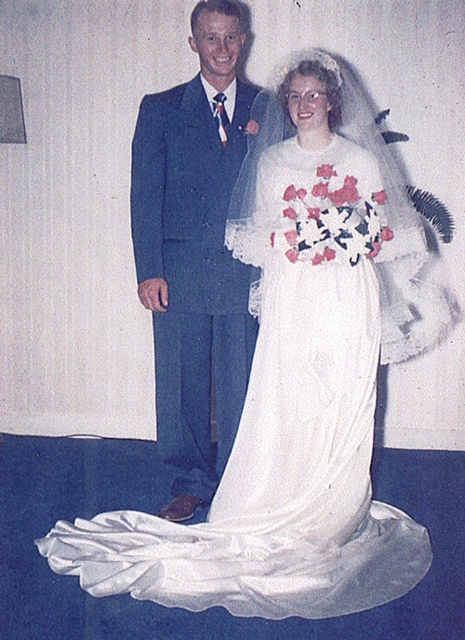
You are a photographer at the wedding and want to capture a clear shot of the white satin dress at center without the blue wool suit at center blocking it. Based on their positions, is this possible?

The white satin dress at center is in front of the blue wool suit at center, so it is possible to capture a clear shot of the white satin dress at center without the blue wool suit at center blocking it.

You are a photographer setting up for a wedding photo. You need to ensure both the white satin dress at center and the blue wool suit at center are fully visible in the frame. Based on their sizes, which one might require more space in the shot?

The white satin dress at center might be wider than the blue wool suit at center, so it might require more space in the shot to ensure it is fully visible.

You are a photographer at a wedding and need to capture a closeup shot of both the white satin dress at center and the blue wool suit at center. The camera you are using has a focus range of 45 centimeters. Can you fit both subjects within the focus range without moving the camera?

The white satin dress at center and blue wool suit at center are 45.62 centimeters apart. Since the distance between them exceeds the camera focus range of 45 centimeters, you cannot fit both subjects within the focus range without moving the camera.